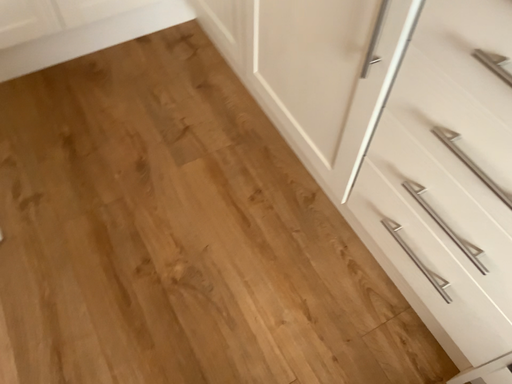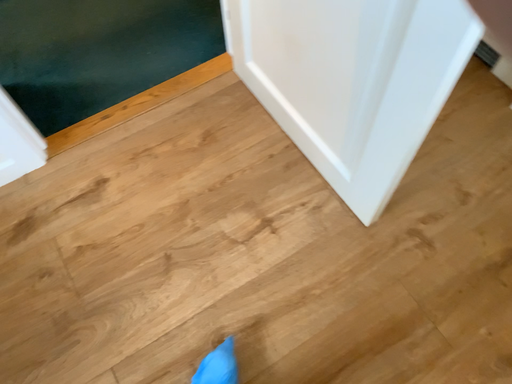
Question: Which way did the camera rotate in the video?

Choices:
 (A) rotated right
 (B) rotated left

Answer: (B)